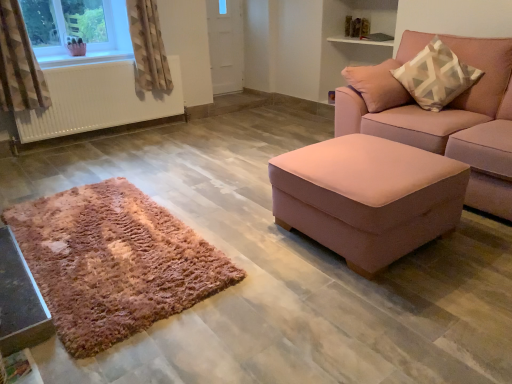
Question: Is white matte door at upper center wider or thinner than geometric patterned fabric curtain at upper left, the 1th curtain when ordered from left to right?

Choices:
 (A) thin
 (B) wide

Answer: (A)

Question: Considering the relative positions of white matte door at upper center and geometric patterned fabric curtain at upper left, which is the 2th curtain in right-to-left order, in the image provided, is white matte door at upper center to the left or to the right of geometric patterned fabric curtain at upper left, which is the 2th curtain in right-to-left order,?

Choices:
 (A) left
 (B) right

Answer: (B)

Question: Which is nearer to the white plastic window at upper left?

Choices:
 (A) pink fabric ottoman at right, which is the first table from right to left
 (B) beige textured curtain at upper left, which is the 2th curtain in front-to-back order
 (C) pink fabric couch at right
 (D) white matte door at upper center
 (E) geometric patterned fabric curtain at upper left, the 1th curtain when ordered from left to right

Answer: (B)

Question: Which is nearer to the shiny black table at lower left, placed as the 1th table when sorted from left to right?

Choices:
 (A) beige textured curtain at upper left, which is the 1th curtain from right to left
 (B) pink fabric ottoman at right, which ranks as the second table in left-to-right order
 (C) white plastic window at upper left
 (D) shaggy pink rug at lower left
 (E) geometric patterned fabric curtain at upper left, placed as the 2th curtain when sorted from back to front

Answer: (D)